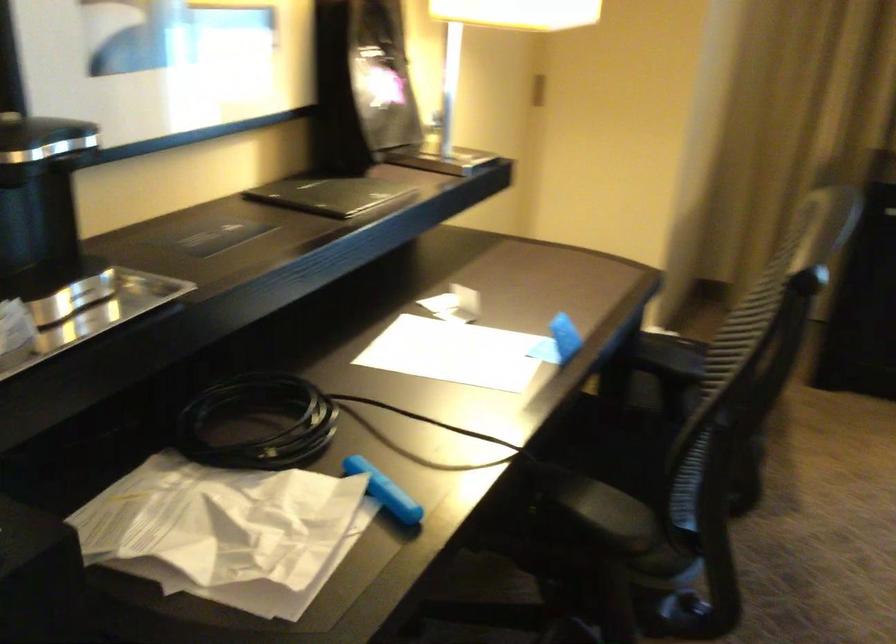
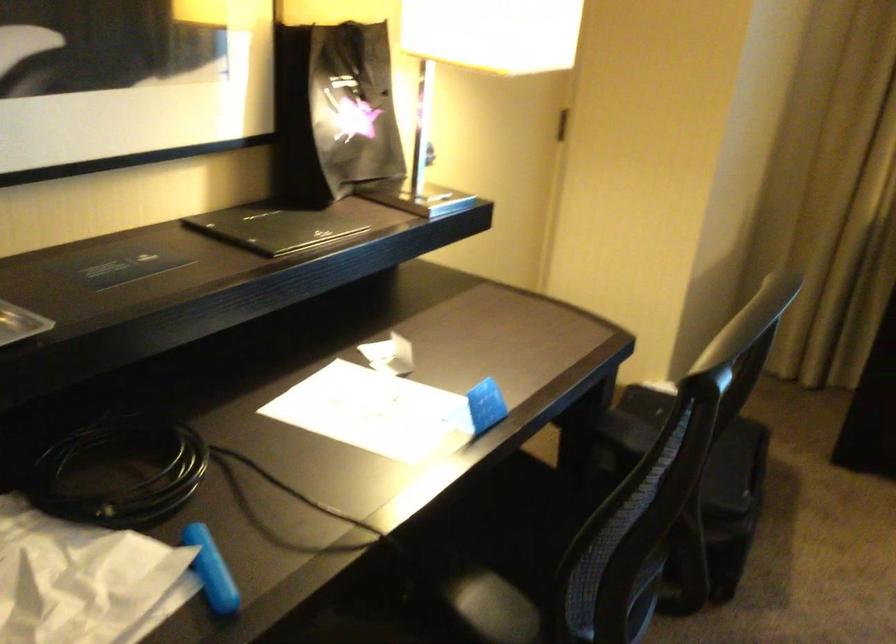
Find the pixel in the second image that matches (384,491) in the first image.

(211, 570)